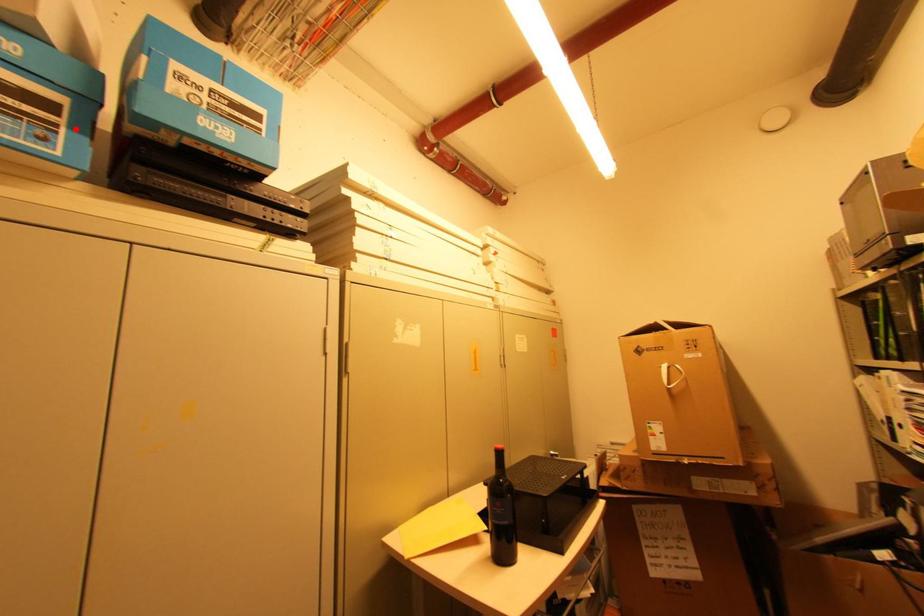
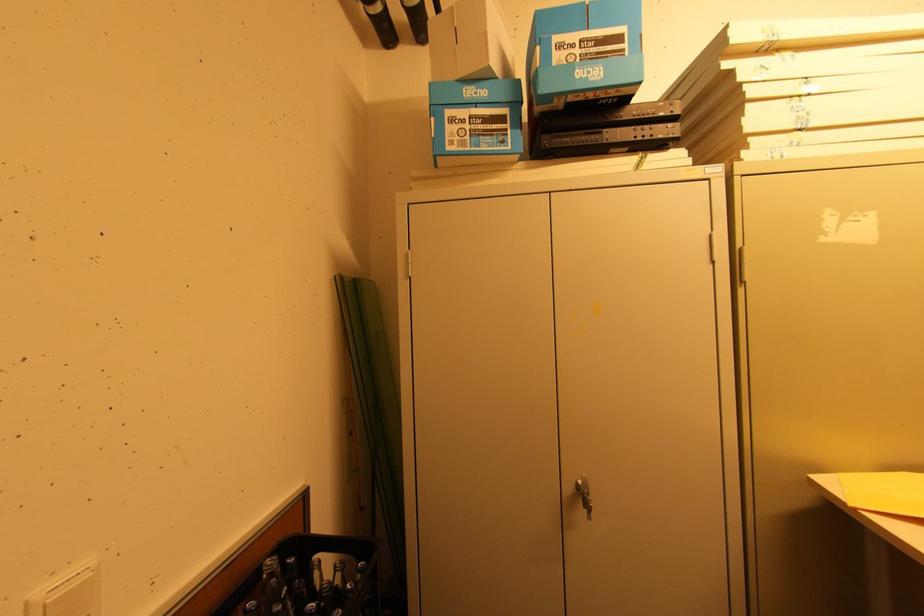
Where in the second image is the point corresponding to the highlighted location from the first image?

(515, 129)